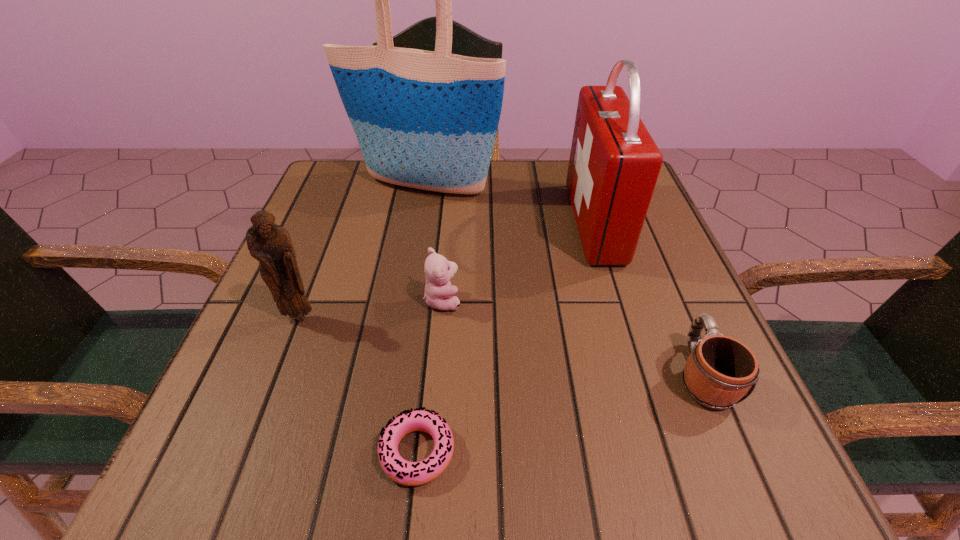
Find the location of a particular element. This screenshot has height=540, width=960. free area in between the rightmost object and the doughnut is located at coordinates (560, 413).

The image size is (960, 540). Identify the location of vacant area that lies between the tote bag and the figurine. (362, 251).

Locate an element on the screen. object that can be found as the closest to the teddy bear is located at coordinates (270, 244).

Where is `object identified as the third closest to the first-aid kit`? This screenshot has width=960, height=540. object identified as the third closest to the first-aid kit is located at coordinates (439, 294).

Locate an element on the screen. This screenshot has width=960, height=540. blank space that satisfies the following two spatial constraints: 1. on the front-facing side of the shortest object; 2. on the right side of the figurine is located at coordinates (248, 452).

Find the location of `vacant space that satisfies the following two spatial constraints: 1. at the face of the third shortest object; 2. on the side of the second nearest object with the handle`. vacant space that satisfies the following two spatial constraints: 1. at the face of the third shortest object; 2. on the side of the second nearest object with the handle is located at coordinates (437, 375).

Where is `free space that satisfies the following two spatial constraints: 1. at the face of the fourth tallest object; 2. on the front-facing side of the figurine`? free space that satisfies the following two spatial constraints: 1. at the face of the fourth tallest object; 2. on the front-facing side of the figurine is located at coordinates (442, 316).

You are a GUI agent. You are given a task and a screenshot of the screen. Output one action in this format:
    pyautogui.click(x=<x>, y=<y>)
    Task: Click on the vacant area in the image that satisfies the following two spatial constraints: 1. on the front side of the nearest object; 2. on the right side of the tallest object
    
    Given the screenshot: What is the action you would take?
    pyautogui.click(x=379, y=452)

Find the location of a particular element. Image resolution: width=960 pixels, height=540 pixels. free spot that satisfies the following two spatial constraints: 1. on the front face of the fifth shortest object; 2. on the front-facing side of the fourth shortest object is located at coordinates (623, 316).

Identify the location of vacant space that satisfies the following two spatial constraints: 1. at the face of the fourth tallest object; 2. on the front-facing side of the figurine. (442, 316).